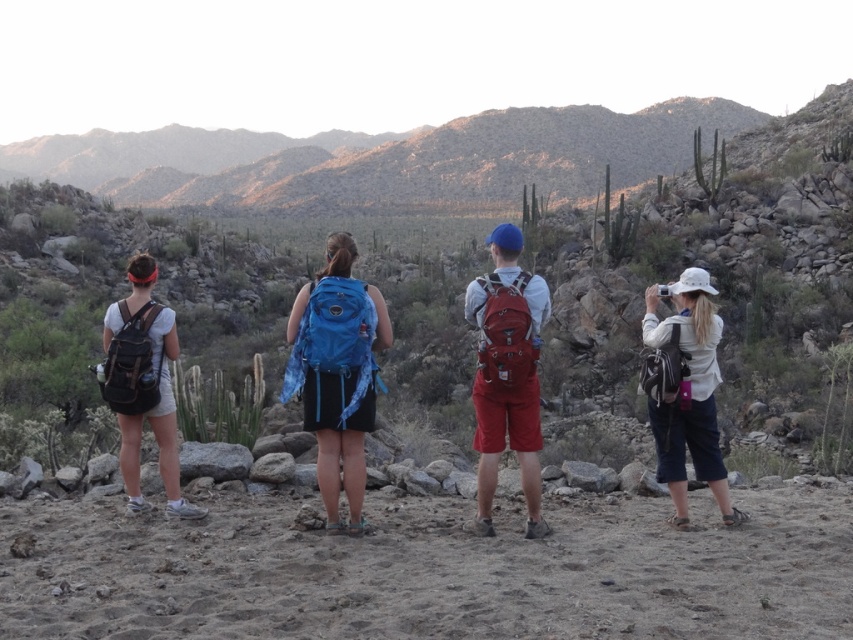
Question: Which point is closer to the camera?

Choices:
 (A) (695, 305)
 (B) (148, 417)

Answer: (A)

Question: Is blue fabric backpack at center above white matte hat at right?

Choices:
 (A) no
 (B) yes

Answer: (B)

Question: Which object is closer to the camera taking this photo?

Choices:
 (A) matte red backpack at center
 (B) blue fabric backpack at center

Answer: (A)

Question: Which object is the farthest from the matte black backpack at left?

Choices:
 (A) matte red backpack at center
 (B) blue fabric backpack at center
 (C) white matte hat at right

Answer: (C)

Question: Is blue fabric backpack at center wider than white matte hat at right?

Choices:
 (A) yes
 (B) no

Answer: (A)

Question: Is blue fabric backpack at center above matte black backpack at left?

Choices:
 (A) no
 (B) yes

Answer: (A)